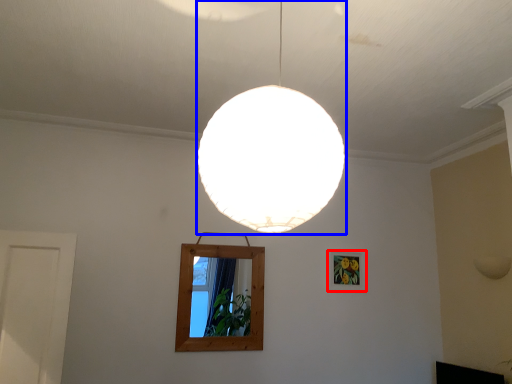
Question: Among these objects, which one is nearest to the camera, picture frame (highlighted by a red box) or lamp (highlighted by a blue box)?

Choices:
 (A) picture frame
 (B) lamp

Answer: (B)